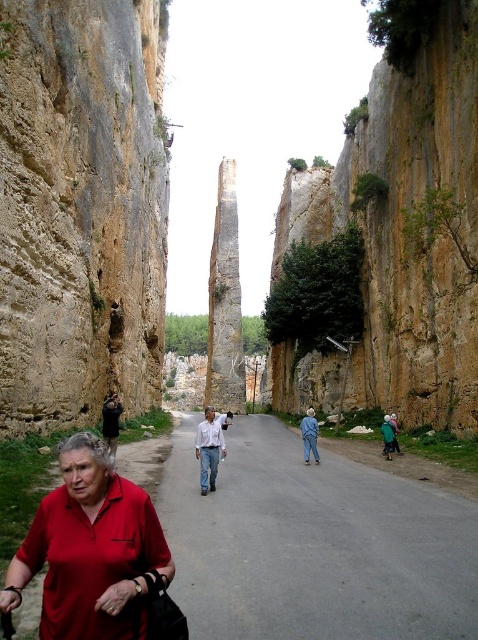
You are standing at the camera position and want to take a photo of the brown rough cliff at center. If your camera has a maximum focus range of 200 feet, will you be able to capture the cliff clearly?

The brown rough cliff at center is 225.60 feet away from the camera. Since this distance exceeds the camera maximum focus range of 200 feet, the cliff will not be in focus and the photo will be blurry.

You are standing on the pathway and see two points marked on the ground ahead of you. The first point is at coordinate point (433, 371) and the second is at point (111, 397). Which point is closer to you?

Point (433, 371) is further to the camera than point (111, 397), so the point closer to you is point (111, 397).